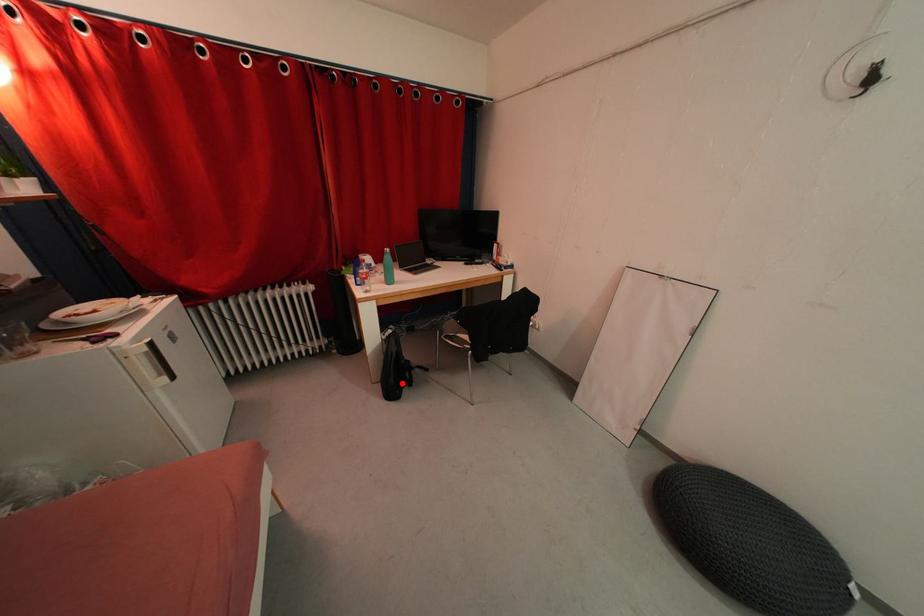
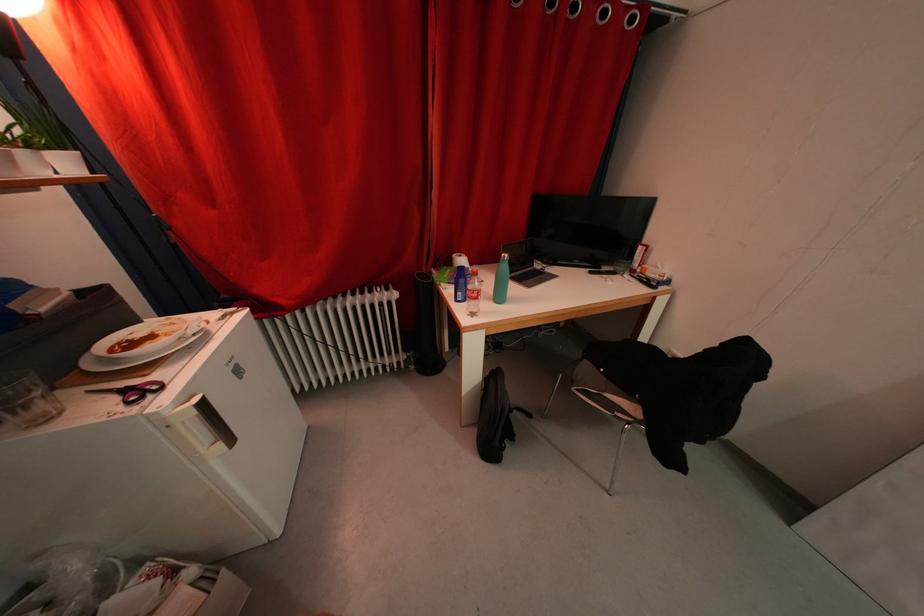
Question: A red point is marked in image1. In image2, is the corresponding 3D point closer to the camera or farther? Reply with the corresponding letter.

Choices:
 (A) The corresponding 3D point is closer.
 (B) The corresponding 3D point is farther.

Answer: (B)